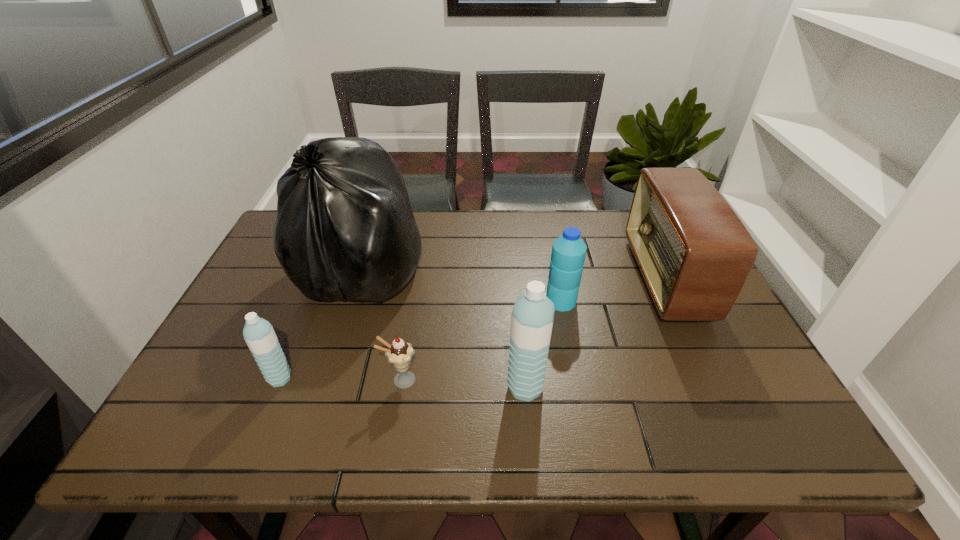
Identify the location of object that is at the right edge. This screenshot has width=960, height=540. (695, 254).

Locate an element on the screen. The height and width of the screenshot is (540, 960). object located in the far left corner section of the desktop is located at coordinates tap(345, 229).

The image size is (960, 540). Identify the location of object located at the far right corner. (695, 254).

Identify the location of vacant space at the far edge of the desktop. This screenshot has height=540, width=960. (545, 225).

The height and width of the screenshot is (540, 960). Find the location of `free location at the left edge`. free location at the left edge is located at coordinates (215, 356).

Image resolution: width=960 pixels, height=540 pixels. Find the location of `free space at the right edge of the desktop`. free space at the right edge of the desktop is located at coordinates (687, 363).

Identify the location of vacant region between the second water bottle from right to left and the icecream. The image size is (960, 540). (463, 383).

Locate an element on the screen. The image size is (960, 540). free space between the leftmost water bottle and the shortest object is located at coordinates (340, 379).

Locate an element on the screen. This screenshot has height=540, width=960. vacant area that lies between the rightmost water bottle and the plastic bag is located at coordinates (462, 284).

What are the coordinates of `free space between the tallest object and the third object from right to left` in the screenshot? It's located at (444, 327).